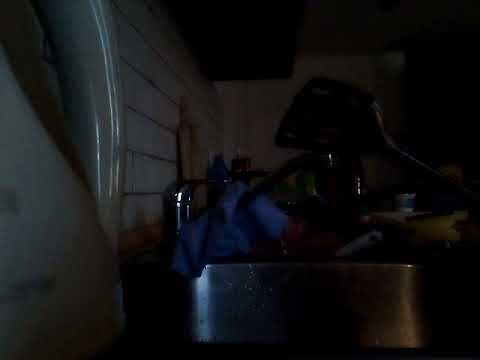
I want to click on scrubber, so click(364, 247).